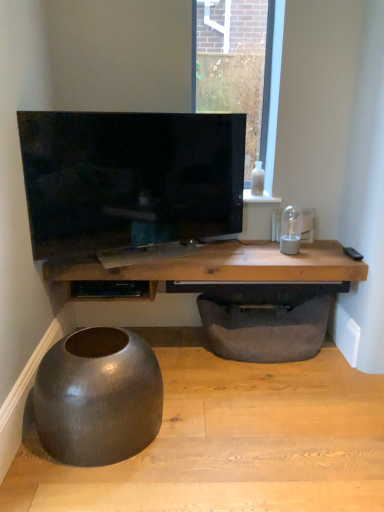
The image size is (384, 512). What are the coordinates of `vacant space in front of dark gray fabric footrest at lower center` in the screenshot? It's located at (276, 404).